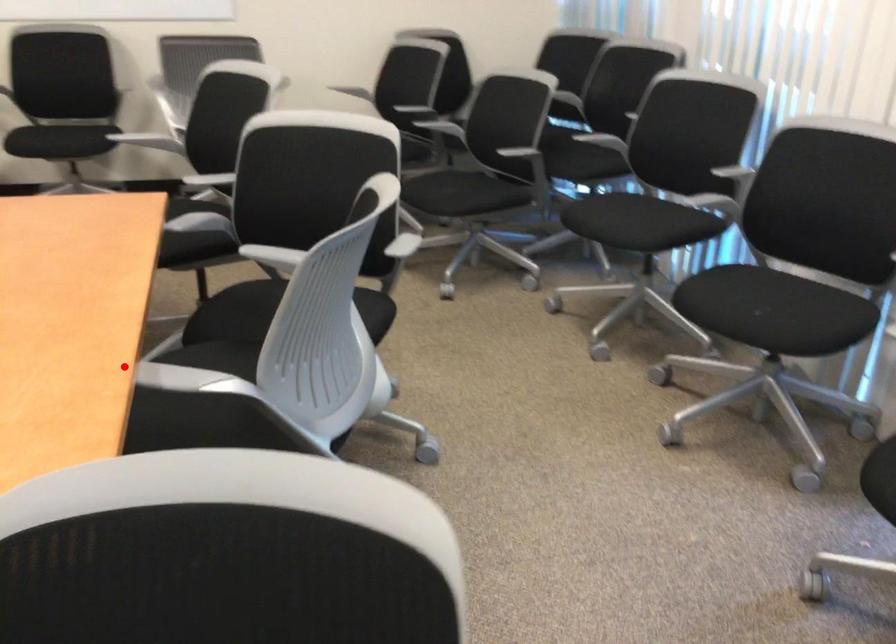
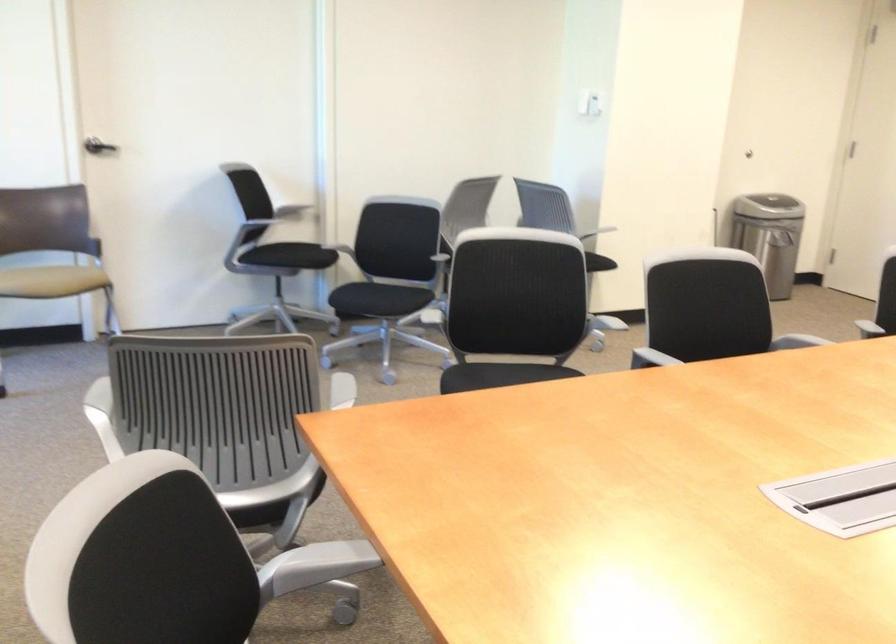
Where in the second image is the point corresponding to the highlighted location from the first image?

(320, 562)